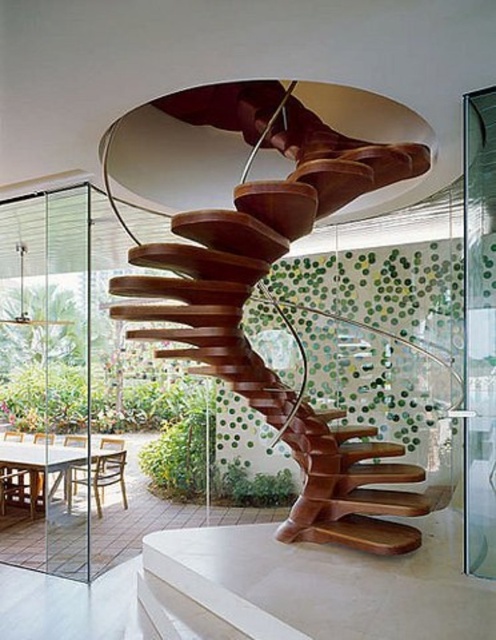
You are an interior designer planning to place a large rectangular sofa in the room. The sofa is 2 meters wide. You want to position it near the transparent glass door at left but need to ensure there is enough space between the sofa and the wooden spiral staircase at center. Can you fit the sofa there without blocking the staircase?

The wooden spiral staircase at center has a width less than the transparent glass door at left. Since the sofa is 2 meters wide, you need to check the available space between the staircase and the door. If the distance between them is at least 2 meters, the sofa can fit. However, without exact measurements of the space between them, it is uncertain. The description only states the staircase is narrower than the door, not the distance between them.

You are a delivery person trying to enter the room through the transparent glass door at right. The wooden spiral staircase at center is in your way. Can you walk through the space between them?

The wooden spiral staircase at center is much taller than the transparent glass door at right, so the space between them is likely narrow. However, since the staircase is at the center and the door is at the right, you should be able to walk around the staircase to reach the transparent glass door at right.

You are standing at the entrance of this modern architectural interior and want to exit through the transparent glass door at left. What direction should you walk to reach it?

You should walk towards the left side of the room since the transparent glass door at left is located at the left side of the space.